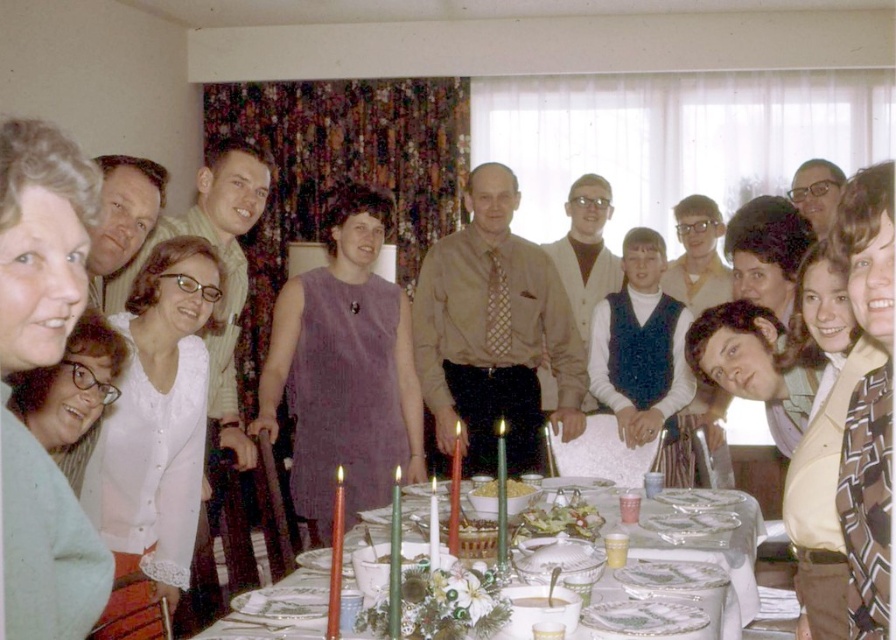
Does white lace cardigan at center have a lesser height compared to white glossy plates at center?

In fact, white lace cardigan at center may be taller than white glossy plates at center.

Does white lace cardigan at center appear over white glossy plates at center?

Indeed, white lace cardigan at center is positioned over white glossy plates at center.

Does point (197, 252) lie in front of point (730, 593)?

No, it is not.

The height and width of the screenshot is (640, 896). Find the location of `white lace cardigan at center`. white lace cardigan at center is located at coordinates (158, 419).

Who is positioned more to the left, white lace cardigan at center or brown textured coat at lower right?

From the viewer's perspective, white lace cardigan at center appears more on the left side.

From the picture: Can you confirm if white lace cardigan at center is positioned below brown textured coat at lower right?

Yes, white lace cardigan at center is below brown textured coat at lower right.

Which is behind, point (136, 564) or point (871, 440)?

Positioned behind is point (136, 564).

Where is `white lace cardigan at center`? The height and width of the screenshot is (640, 896). white lace cardigan at center is located at coordinates (158, 419).

Can you confirm if patterned fabric blazer at lower right is thinner than white matte bowl at center?

No.

Is patterned fabric blazer at lower right positioned in front of white matte bowl at center?

That is True.

The width and height of the screenshot is (896, 640). Describe the element at coordinates (872, 289) in the screenshot. I see `patterned fabric blazer at lower right` at that location.

The height and width of the screenshot is (640, 896). Identify the location of patterned fabric blazer at lower right. (872, 289).